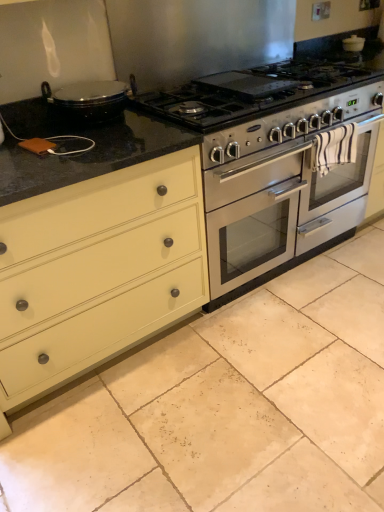
Question: Is stainless steel oven at center next to beige matte tile at center and touching it?

Choices:
 (A) yes
 (B) no

Answer: (B)

Question: Can you confirm if stainless steel oven at center is wider than beige matte tile at center?

Choices:
 (A) no
 (B) yes

Answer: (A)

Question: Can you confirm if stainless steel oven at center is shorter than beige matte tile at center?

Choices:
 (A) yes
 (B) no

Answer: (B)

Question: From a real-world perspective, is stainless steel oven at center on top of beige matte tile at center?

Choices:
 (A) no
 (B) yes

Answer: (B)

Question: Is stainless steel oven at center to the left of beige matte tile at center from the viewer's perspective?

Choices:
 (A) yes
 (B) no

Answer: (A)

Question: From the image's perspective, relative to stainless steel oven at center, is matte cream drawer at left above or below?

Choices:
 (A) above
 (B) below

Answer: (B)

Question: Considering the positions of matte cream drawer at left and stainless steel oven at center in the image, is matte cream drawer at left wider or thinner than stainless steel oven at center?

Choices:
 (A) wide
 (B) thin

Answer: (B)

Question: Is matte cream drawer at left bigger or smaller than stainless steel oven at center?

Choices:
 (A) small
 (B) big

Answer: (B)

Question: In the image, is matte cream drawer at left on the left side or the right side of stainless steel oven at center?

Choices:
 (A) right
 (B) left

Answer: (B)

Question: Is point (158, 280) positioned closer to the camera than point (365, 354)?

Choices:
 (A) farther
 (B) closer

Answer: (B)

Question: Considering their positions, is matte cream drawer at left located in front of or behind beige matte tile at center?

Choices:
 (A) behind
 (B) front

Answer: (A)

Question: Is matte cream drawer at left taller or shorter than beige matte tile at center?

Choices:
 (A) short
 (B) tall

Answer: (B)

Question: Based on their sizes in the image, would you say matte cream drawer at left is bigger or smaller than beige matte tile at center?

Choices:
 (A) big
 (B) small

Answer: (A)

Question: Is satin silver gas stove at center situated inside beige matte tile at center or outside?

Choices:
 (A) outside
 (B) inside

Answer: (A)

Question: Is satin silver gas stove at center in front of or behind beige matte tile at center in the image?

Choices:
 (A) behind
 (B) front

Answer: (A)